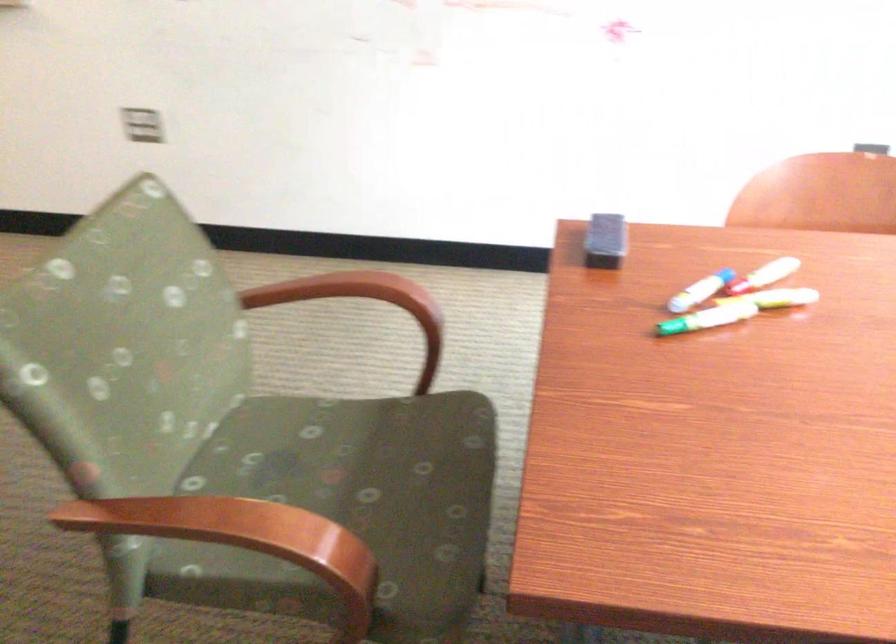
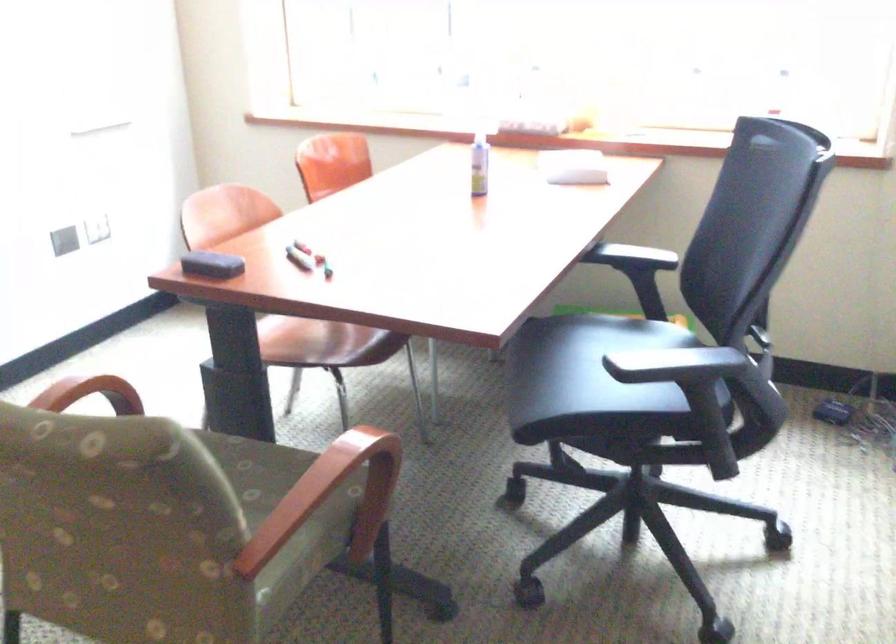
Locate, in the second image, the point that corresponds to (416,484) in the first image.

(251, 469)